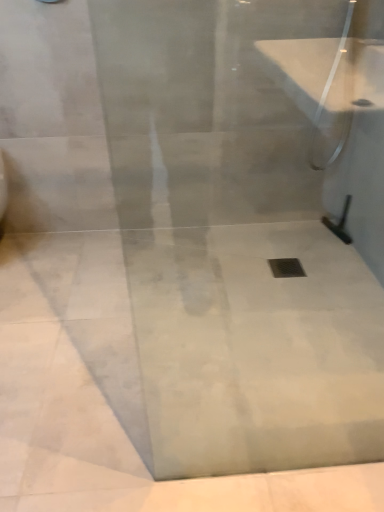
Question: Considering the relative positions of white marble concrete at center and clear glass shower door at upper right, the 2th shower when ordered from bottom to top, in the image provided, is white marble concrete at center to the right of clear glass shower door at upper right, the 2th shower when ordered from bottom to top, from the viewer's perspective?

Choices:
 (A) yes
 (B) no

Answer: (B)

Question: Is clear glass shower door at upper right, the 2th shower when ordered from bottom to top, completely or partially inside white marble concrete at center?

Choices:
 (A) no
 (B) yes

Answer: (A)

Question: Is white marble concrete at center at the left side of clear glass shower door at upper right, which ranks as the first shower in top-to-bottom order?

Choices:
 (A) no
 (B) yes

Answer: (B)

Question: Is white marble concrete at center outside of clear glass shower door at upper right, which ranks as the first shower in top-to-bottom order?

Choices:
 (A) yes
 (B) no

Answer: (A)

Question: Is white marble concrete at center in contact with clear glass shower door at upper right, which ranks as the first shower in top-to-bottom order?

Choices:
 (A) yes
 (B) no

Answer: (B)

Question: Based on their sizes in the image, would you say metallic silver drain at center is bigger or smaller than black rubber squeegee at right, which is the first shower in bottom-to-top order?

Choices:
 (A) small
 (B) big

Answer: (A)

Question: From the image's perspective, is metallic silver drain at center above or below black rubber squeegee at right, marked as the 2th shower in a top-to-bottom arrangement?

Choices:
 (A) below
 (B) above

Answer: (A)

Question: Looking at their shapes, would you say metallic silver drain at center is wider or thinner than black rubber squeegee at right, which is the first shower in bottom-to-top order?

Choices:
 (A) thin
 (B) wide

Answer: (B)

Question: In the image, is metallic silver drain at center positioned in front of or behind black rubber squeegee at right, marked as the 2th shower in a top-to-bottom arrangement?

Choices:
 (A) front
 (B) behind

Answer: (A)

Question: Would you say black rubber squeegee at right, which is the first shower in bottom-to-top order, is to the left or to the right of clear glass shower door at upper right, which ranks as the first shower in top-to-bottom order, in the picture?

Choices:
 (A) right
 (B) left

Answer: (A)

Question: Based on their sizes in the image, would you say black rubber squeegee at right, marked as the 2th shower in a top-to-bottom arrangement, is bigger or smaller than clear glass shower door at upper right, the 2th shower when ordered from bottom to top?

Choices:
 (A) big
 (B) small

Answer: (B)

Question: Do you think black rubber squeegee at right, which is the first shower in bottom-to-top order, is within clear glass shower door at upper right, the 2th shower when ordered from bottom to top, or outside of it?

Choices:
 (A) inside
 (B) outside

Answer: (B)

Question: From a real-world perspective, is black rubber squeegee at right, marked as the 2th shower in a top-to-bottom arrangement, physically located above or below clear glass shower door at upper right, which ranks as the first shower in top-to-bottom order?

Choices:
 (A) above
 (B) below

Answer: (B)

Question: Looking at their shapes, would you say black rubber squeegee at right, marked as the 2th shower in a top-to-bottom arrangement, is wider or thinner than metallic silver drain at center?

Choices:
 (A) wide
 (B) thin

Answer: (B)

Question: Looking at the image, does black rubber squeegee at right, marked as the 2th shower in a top-to-bottom arrangement, seem bigger or smaller compared to metallic silver drain at center?

Choices:
 (A) small
 (B) big

Answer: (B)